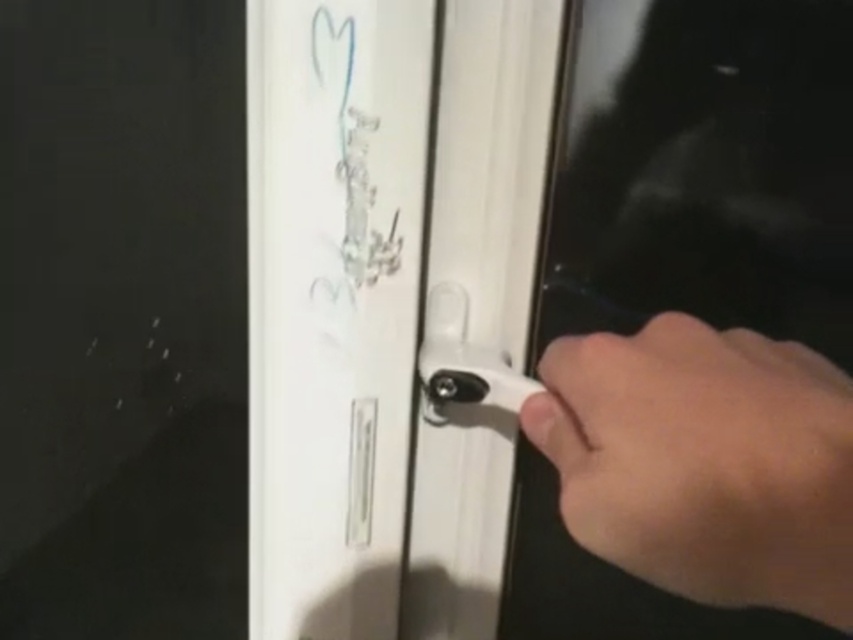
Which is above, white glossy door handle at center or white plastic door handle at center?

white plastic door handle at center

Can you confirm if white glossy door handle at center is positioned below white plastic door handle at center?

Indeed, white glossy door handle at center is positioned under white plastic door handle at center.

This screenshot has height=640, width=853. In order to click on white glossy door handle at center in this screenshot , I will do `click(332, 305)`.

Locate an element on the screen. white glossy door handle at center is located at coordinates (332, 305).

Can you confirm if white glossy door handle at center is taller than skinny white hand at right?

Yes, white glossy door handle at center is taller than skinny white hand at right.

Based on the photo, is white glossy door handle at center to the left of skinny white hand at right from the viewer's perspective?

Indeed, white glossy door handle at center is positioned on the left side of skinny white hand at right.

Measure the distance between white glossy door handle at center and camera.

white glossy door handle at center and camera are 18.66 inches apart.

What are the coordinates of `white glossy door handle at center` in the screenshot? It's located at (332, 305).

Find the location of a particular element. This screenshot has width=853, height=640. skinny white hand at right is located at coordinates (704, 461).

How far apart are skinny white hand at right and white plastic door handle at center?

skinny white hand at right and white plastic door handle at center are 12.51 centimeters apart.

Which is behind, point (639, 358) or point (460, 289)?

The point (460, 289) is behind.

Locate an element on the screen. This screenshot has width=853, height=640. skinny white hand at right is located at coordinates (704, 461).